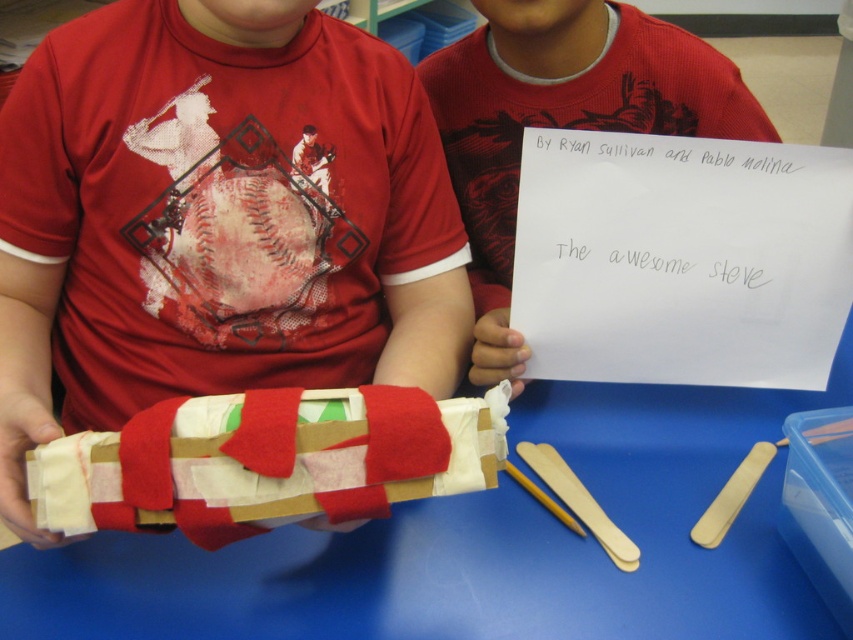
Question: Estimate the real-world distances between objects in this image. Which object is closer to the felt wrapped book at center?

Choices:
 (A) matte felt sign at upper center
 (B) cardboard box at center

Answer: (B)

Question: Does cardboard box at center lie behind felt wrapped book at center?

Choices:
 (A) yes
 (B) no

Answer: (A)

Question: Is cardboard box at center bigger than matte felt sign at upper center?

Choices:
 (A) no
 (B) yes

Answer: (B)

Question: Which of these objects is positioned closest to the cardboard box at center?

Choices:
 (A) matte felt sign at upper center
 (B) felt wrapped book at center

Answer: (A)

Question: Does felt wrapped book at center have a greater width compared to matte felt sign at upper center?

Choices:
 (A) no
 (B) yes

Answer: (A)

Question: Which object is positioned closest to the felt wrapped book at center?

Choices:
 (A) cardboard box at center
 (B) matte felt sign at upper center

Answer: (A)